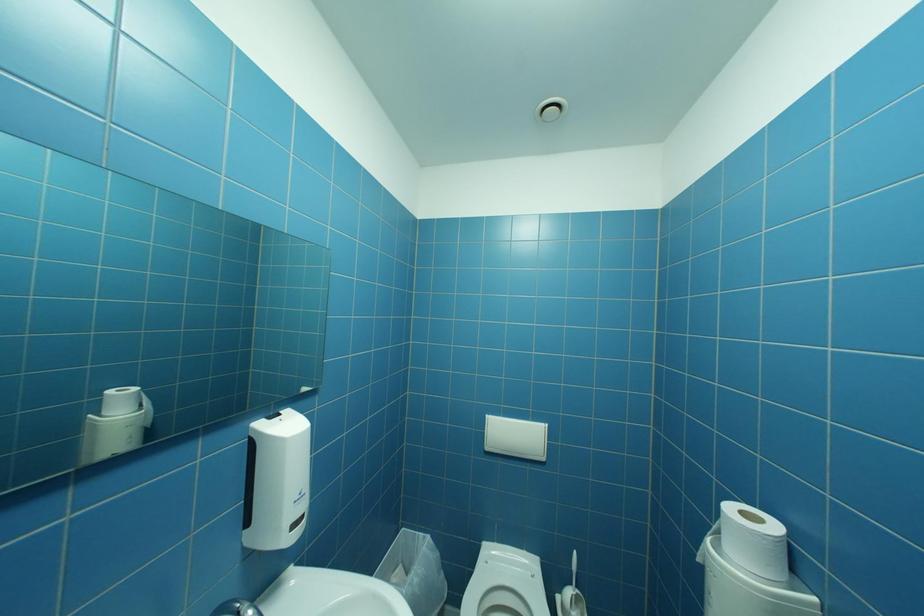
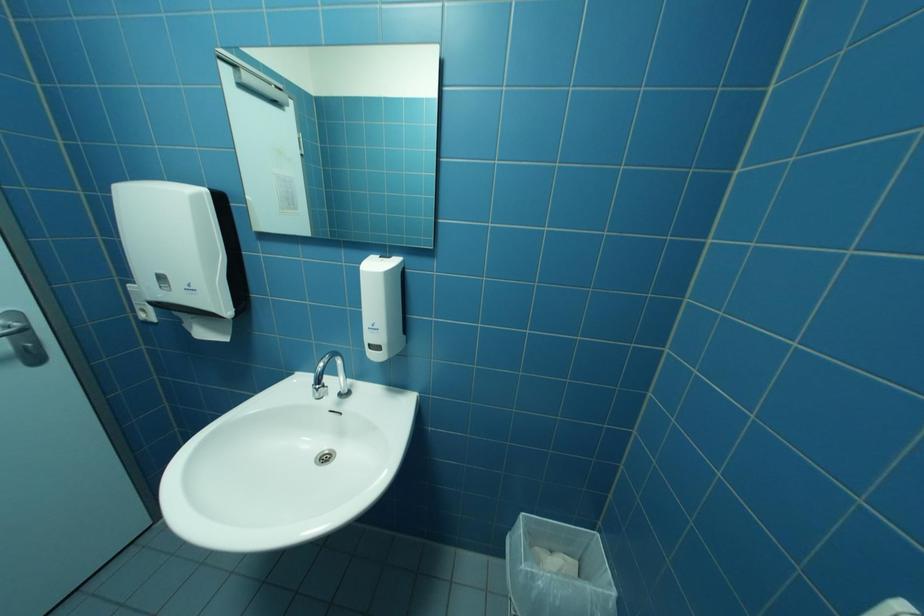
How did the camera likely rotate?

The camera's rotation is toward left-down.